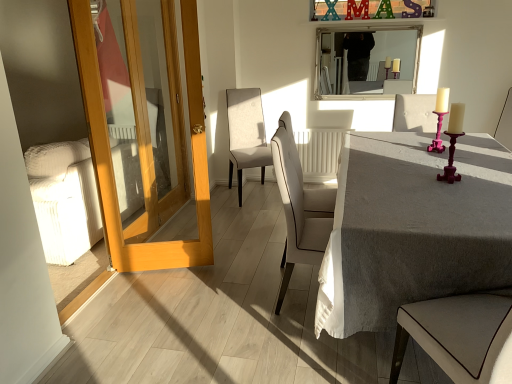
Question: Is gray linen table at center in contact with light wood door at left?

Choices:
 (A) yes
 (B) no

Answer: (B)

Question: Considering the relative positions of gray linen table at center and light wood door at left in the image provided, is gray linen table at center to the left of light wood door at left from the viewer's perspective?

Choices:
 (A) no
 (B) yes

Answer: (A)

Question: From the image's perspective, would you say gray linen table at center is shown under light wood door at left?

Choices:
 (A) no
 (B) yes

Answer: (B)

Question: Is gray linen table at center closer to camera compared to light wood door at left?

Choices:
 (A) yes
 (B) no

Answer: (A)

Question: Is gray linen table at center shorter than light wood door at left?

Choices:
 (A) yes
 (B) no

Answer: (A)

Question: From a real-world perspective, is silver/metallic mirror at upper center above or below gray linen table at center?

Choices:
 (A) above
 (B) below

Answer: (A)

Question: Visually, is silver/metallic mirror at upper center positioned to the left or to the right of gray linen table at center?

Choices:
 (A) left
 (B) right

Answer: (A)

Question: Is point (373, 38) positioned closer to the camera than point (442, 192)?

Choices:
 (A) farther
 (B) closer

Answer: (A)

Question: From the image's perspective, is silver/metallic mirror at upper center above or below gray linen table at center?

Choices:
 (A) below
 (B) above

Answer: (B)

Question: Considering the positions of white leather chair at center, which ranks as the 3th chair in back-to-front order, and silver/metallic mirror at upper center in the image, is white leather chair at center, which ranks as the 3th chair in back-to-front order, taller or shorter than silver/metallic mirror at upper center?

Choices:
 (A) short
 (B) tall

Answer: (B)

Question: Based on their sizes in the image, would you say white leather chair at center, arranged as the first chair when viewed from the front, is bigger or smaller than silver/metallic mirror at upper center?

Choices:
 (A) small
 (B) big

Answer: (B)

Question: Is white leather chair at center, which ranks as the 2th chair in left-to-right order, inside the boundaries of silver/metallic mirror at upper center, or outside?

Choices:
 (A) outside
 (B) inside

Answer: (A)

Question: Considering their positions, is white leather chair at center, arranged as the first chair when viewed from the front, located in front of or behind silver/metallic mirror at upper center?

Choices:
 (A) front
 (B) behind

Answer: (A)

Question: From a real-world perspective, is beige fabric chair at center, marked as the 1th chair in a left-to-right arrangement, physically located above or below pink velvet chair at upper right, the second chair viewed from the back?

Choices:
 (A) above
 (B) below

Answer: (B)

Question: In the image, is beige fabric chair at center, the 3th chair from the front, positioned in front of or behind pink velvet chair at upper right, which is the 3th chair from left to right?

Choices:
 (A) behind
 (B) front

Answer: (A)